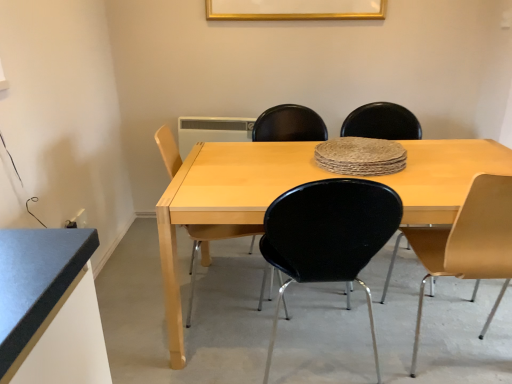
From a real-world perspective, Pinpoint a few locations in the empty space that is ontop of gold metallic picture frame at upper center. Your answer should be formatted as a list of tuples, i.e. [(x1, y1)], where each tuple contains the x and y coordinates of a point satisfying the conditions above.

[(0.558, -0.000)]